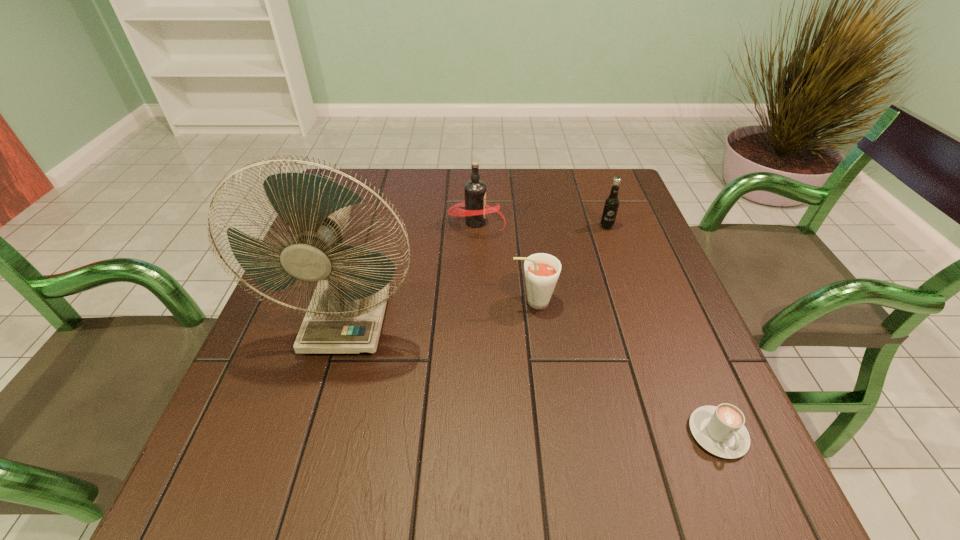
Image resolution: width=960 pixels, height=540 pixels. What are the coordinates of `vacant space situated 0.350m on the drink side of the nearest root beer` in the screenshot? It's located at (353, 301).

Find the location of a particular element. This screenshot has height=540, width=960. free location located on the drink side of the nearest root beer is located at coordinates (340, 301).

Locate an element on the screen. This screenshot has height=540, width=960. free location located on the drink side of the nearest root beer is located at coordinates pyautogui.click(x=461, y=301).

Find the location of a particular element. The image size is (960, 540). free point located to the right of the nearest object is located at coordinates (751, 514).

Where is `object located at the far edge`? object located at the far edge is located at coordinates (476, 209).

Image resolution: width=960 pixels, height=540 pixels. I want to click on object at the left edge, so click(345, 315).

Locate an element on the screen. The image size is (960, 540). root beer that is at the right edge is located at coordinates (611, 204).

What are the coordinates of `cappuccino at the right edge` in the screenshot? It's located at (720, 430).

At what (x,y) coordinates should I click in order to perform the action: click on vacant area at the far edge of the desktop. Please return your answer as a coordinate pair (x, y). The width and height of the screenshot is (960, 540). Looking at the image, I should click on (414, 183).

The width and height of the screenshot is (960, 540). Find the location of `vacant space at the left edge of the desktop`. vacant space at the left edge of the desktop is located at coordinates (292, 338).